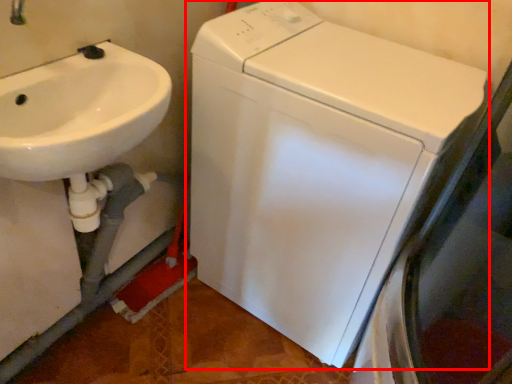
Question: From the image's perspective, what is the correct spatial positioning of washing machine (annotated by the red box) in reference to sink?

Choices:
 (A) below
 (B) above

Answer: (A)